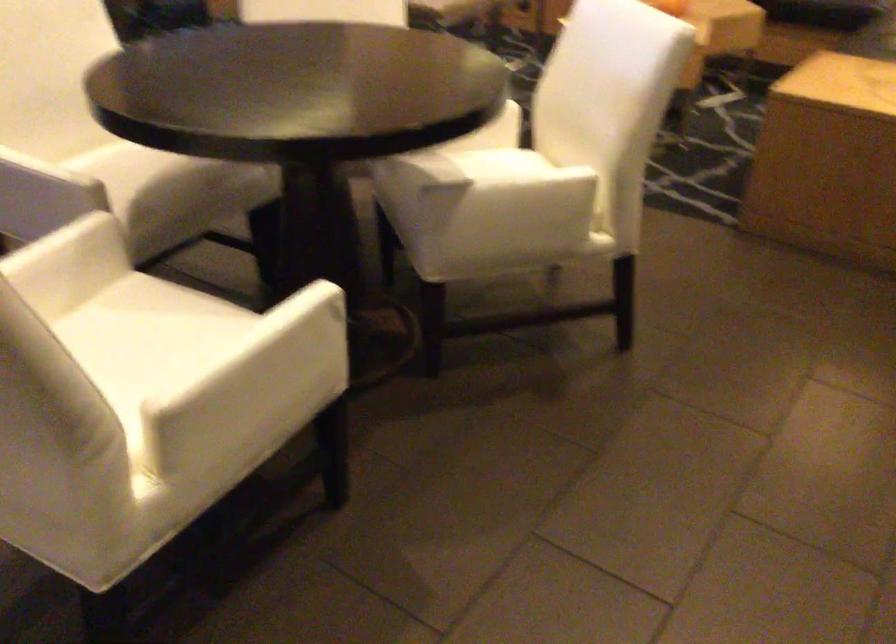
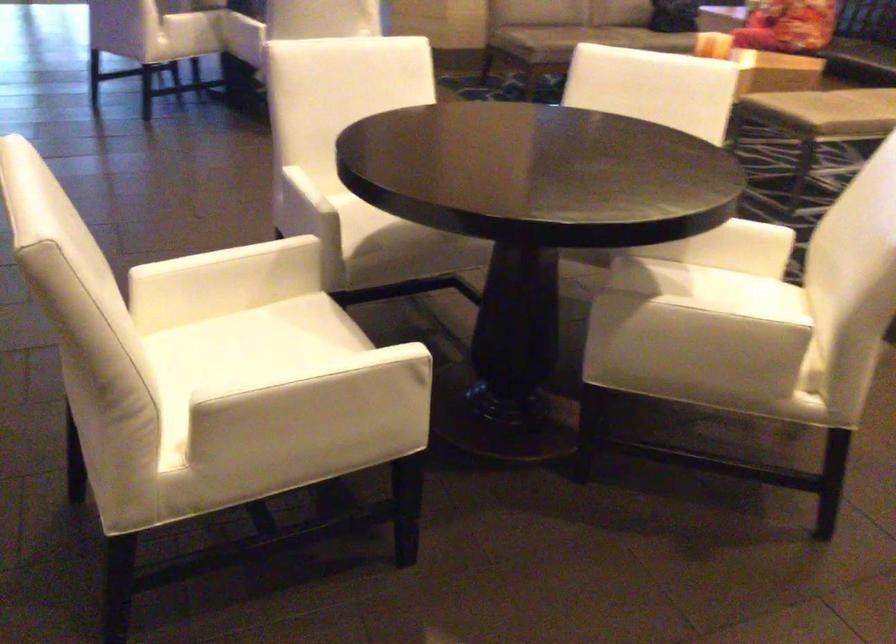
Find the pixel in the second image that matches (126,187) in the first image.

(372, 223)